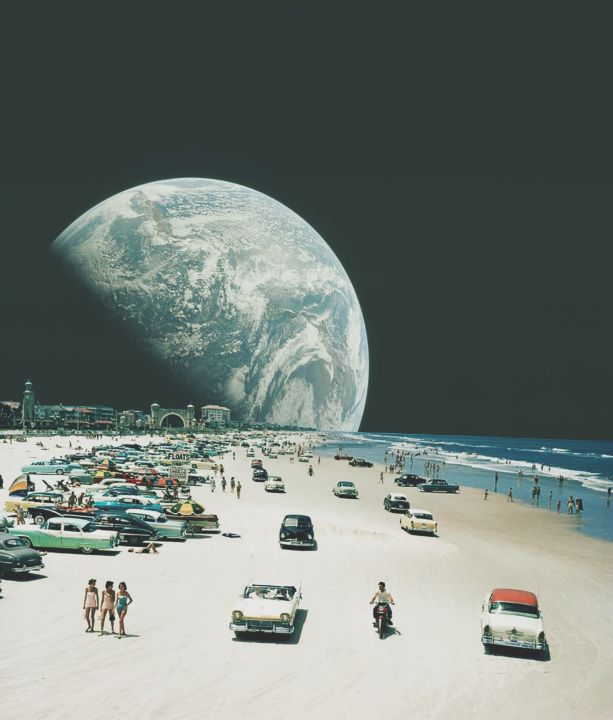
Where is `arched doorway`? arched doorway is located at coordinates (173, 417).